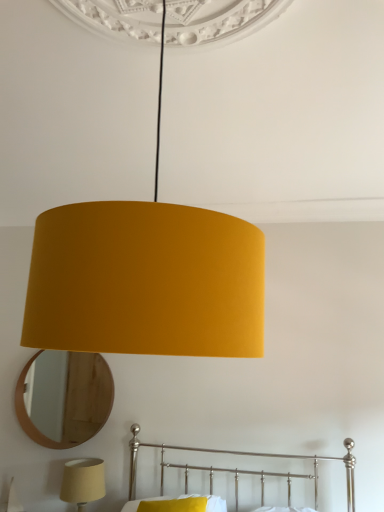
Question: Is matte yellow lampshade at lower left, which is the second lamp in front-to-back order, outside of metallic silver bed at lower center?

Choices:
 (A) yes
 (B) no

Answer: (A)

Question: From the image's perspective, is matte yellow lampshade at lower left, which is the second lamp in front-to-back order, over metallic silver bed at lower center?

Choices:
 (A) yes
 (B) no

Answer: (B)

Question: Considering the relative positions of matte yellow lampshade at lower left, which appears as the 2th lamp when viewed from the right, and metallic silver bed at lower center in the image provided, is matte yellow lampshade at lower left, which appears as the 2th lamp when viewed from the right, to the right of metallic silver bed at lower center from the viewer's perspective?

Choices:
 (A) no
 (B) yes

Answer: (A)

Question: Can you confirm if matte yellow lampshade at lower left, which appears as the 1th lamp when viewed from the left, is shorter than metallic silver bed at lower center?

Choices:
 (A) yes
 (B) no

Answer: (A)

Question: Is matte yellow lampshade at lower left, which is the first lamp in bottom-to-top order, not close to metallic silver bed at lower center?

Choices:
 (A) yes
 (B) no

Answer: (B)

Question: Is matte yellow lampshade at lower left, which is the second lamp in front-to-back order, bigger than metallic silver bed at lower center?

Choices:
 (A) yes
 (B) no

Answer: (B)

Question: Considering the relative sizes of matte yellow fabric lampshade at center, which is the second lamp from left to right, and wooden mirror at lower left in the image provided, is matte yellow fabric lampshade at center, which is the second lamp from left to right, taller than wooden mirror at lower left?

Choices:
 (A) yes
 (B) no

Answer: (A)

Question: Is matte yellow fabric lampshade at center, marked as the first lamp in a front-to-back arrangement, placed right next to wooden mirror at lower left?

Choices:
 (A) yes
 (B) no

Answer: (B)

Question: Is matte yellow fabric lampshade at center, marked as the first lamp in a right-to-left arrangement, surrounding wooden mirror at lower left?

Choices:
 (A) no
 (B) yes

Answer: (A)

Question: From a real-world perspective, is matte yellow fabric lampshade at center, marked as the first lamp in a front-to-back arrangement, under wooden mirror at lower left?

Choices:
 (A) yes
 (B) no

Answer: (B)

Question: Is matte yellow fabric lampshade at center, marked as the first lamp in a right-to-left arrangement, positioned behind wooden mirror at lower left?

Choices:
 (A) yes
 (B) no

Answer: (B)

Question: Is matte yellow fabric lampshade at center, the second lamp when ordered from bottom to top, positioned beyond the bounds of wooden mirror at lower left?

Choices:
 (A) yes
 (B) no

Answer: (A)

Question: From a real-world perspective, is wooden mirror at lower left physically above yellow fabric pillow at lower center?

Choices:
 (A) yes
 (B) no

Answer: (A)